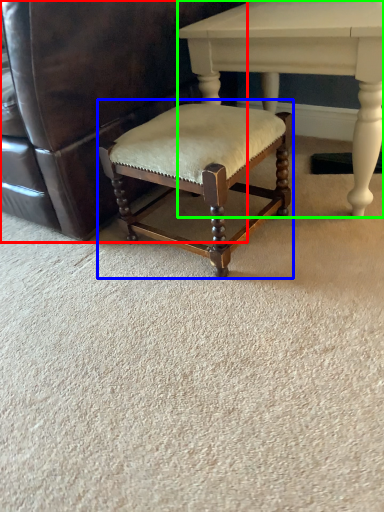
Question: Estimate the real-world distances between objects in this image. Which object is closer to chair (highlighted by a red box), bar stool (highlighted by a blue box) or table (highlighted by a green box)?

Choices:
 (A) bar stool
 (B) table

Answer: (A)